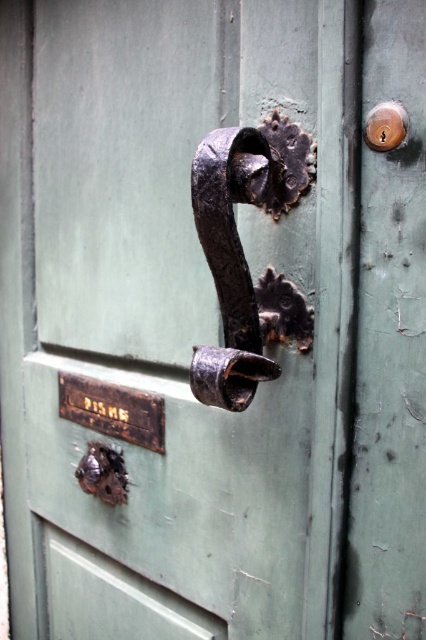
Question: Which point appears closest to the camera in this image?

Choices:
 (A) (112, 499)
 (B) (238, 406)
 (C) (379, 108)

Answer: (C)

Question: In this image, where is rusty metal latch at lower left located relative to polished brass keyhole at upper right?

Choices:
 (A) left
 (B) right

Answer: (A)

Question: Can you confirm if rusty metal door handle at center is smaller than polished brass keyhole at upper right?

Choices:
 (A) no
 (B) yes

Answer: (A)

Question: Is rusty metal door handle at center wider than rusty metal latch at lower left?

Choices:
 (A) no
 (B) yes

Answer: (B)

Question: Which object appears closest to the camera in this image?

Choices:
 (A) rusty metal door handle at center
 (B) polished brass keyhole at upper right

Answer: (A)

Question: Which point is closer to the camera?

Choices:
 (A) (123, 492)
 (B) (388, 144)
 (C) (236, 355)

Answer: (B)